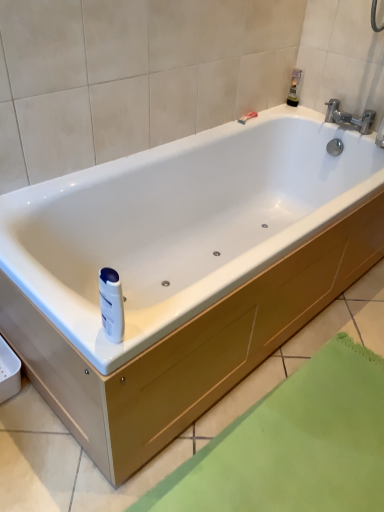
Question: Is translucent plastic bottle at upper right, which is the 1th toiletry from back to front, outside of matte plastic razor at upper right?

Choices:
 (A) no
 (B) yes

Answer: (B)

Question: Considering the relative sizes of translucent plastic bottle at upper right, which is the 1th toiletry from back to front, and matte plastic razor at upper right in the image provided, is translucent plastic bottle at upper right, which is the 1th toiletry from back to front, taller than matte plastic razor at upper right?

Choices:
 (A) yes
 (B) no

Answer: (A)

Question: Does translucent plastic bottle at upper right, the first toiletry in the right-to-left sequence, appear on the left side of matte plastic razor at upper right?

Choices:
 (A) no
 (B) yes

Answer: (A)

Question: Does translucent plastic bottle at upper right, which is the 1th toiletry from back to front, have a lesser width compared to matte plastic razor at upper right?

Choices:
 (A) no
 (B) yes

Answer: (A)

Question: From the image's perspective, does translucent plastic bottle at upper right, arranged as the 1th toiletry when viewed from the top, appear higher than matte plastic razor at upper right?

Choices:
 (A) no
 (B) yes

Answer: (B)

Question: Is translucent plastic bottle at upper right, arranged as the second toiletry when viewed from the front, in contact with matte plastic razor at upper right?

Choices:
 (A) yes
 (B) no

Answer: (B)

Question: Considering the relative positions of silver metallic faucet at upper right and matte plastic razor at upper right in the image provided, is silver metallic faucet at upper right to the left of matte plastic razor at upper right from the viewer's perspective?

Choices:
 (A) no
 (B) yes

Answer: (A)

Question: Can you confirm if silver metallic faucet at upper right is smaller than matte plastic razor at upper right?

Choices:
 (A) no
 (B) yes

Answer: (A)

Question: From the image's perspective, does silver metallic faucet at upper right appear higher than matte plastic razor at upper right?

Choices:
 (A) yes
 (B) no

Answer: (B)

Question: From a real-world perspective, is silver metallic faucet at upper right beneath matte plastic razor at upper right?

Choices:
 (A) yes
 (B) no

Answer: (B)

Question: From a real-world perspective, is silver metallic faucet at upper right physically above matte plastic razor at upper right?

Choices:
 (A) yes
 (B) no

Answer: (A)

Question: Is silver metallic faucet at upper right thinner than matte plastic razor at upper right?

Choices:
 (A) yes
 (B) no

Answer: (B)

Question: Is matte plastic razor at upper right at the right side of silver metallic faucet at upper right?

Choices:
 (A) yes
 (B) no

Answer: (B)